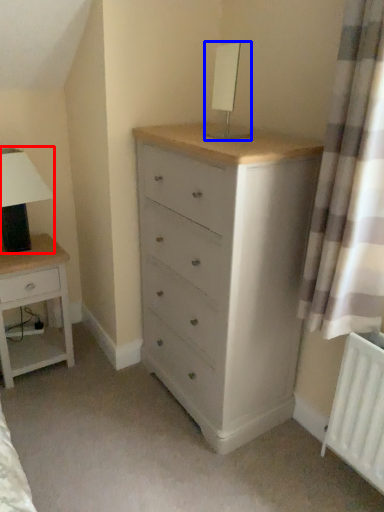
Question: Among these objects, which one is farthest to the camera, table lamp (highlighted by a red box) or table lamp (highlighted by a blue box)?

Choices:
 (A) table lamp
 (B) table lamp

Answer: (A)